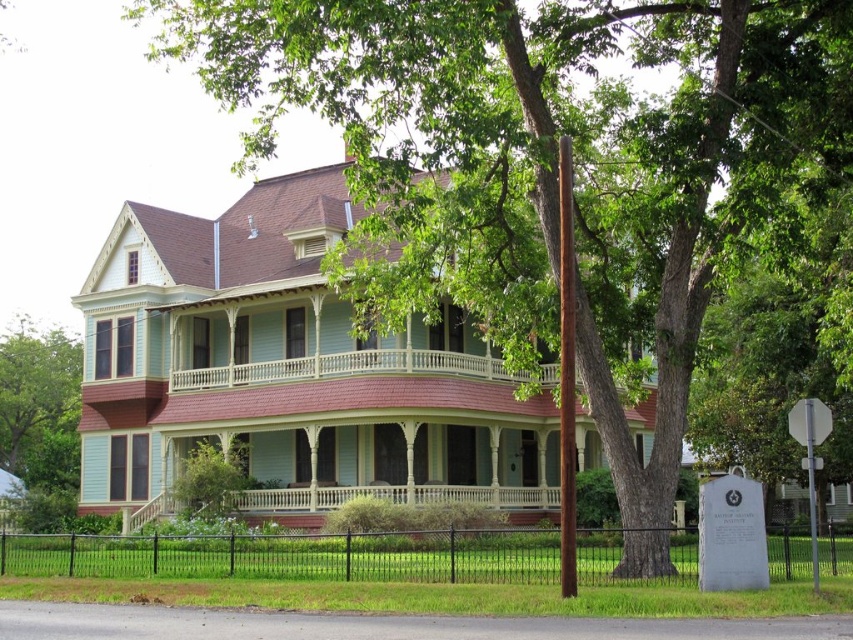
Is black metal fence at lower center to the left of green leafy tree at left from the viewer's perspective?

No, black metal fence at lower center is not to the left of green leafy tree at left.

Does black metal fence at lower center have a lesser height compared to green leafy tree at left?

Yes, black metal fence at lower center is shorter than green leafy tree at left.

What do you see at coordinates (292, 556) in the screenshot? Image resolution: width=853 pixels, height=640 pixels. I see `black metal fence at lower center` at bounding box center [292, 556].

Locate an element on the screen. Image resolution: width=853 pixels, height=640 pixels. black metal fence at lower center is located at coordinates (292, 556).